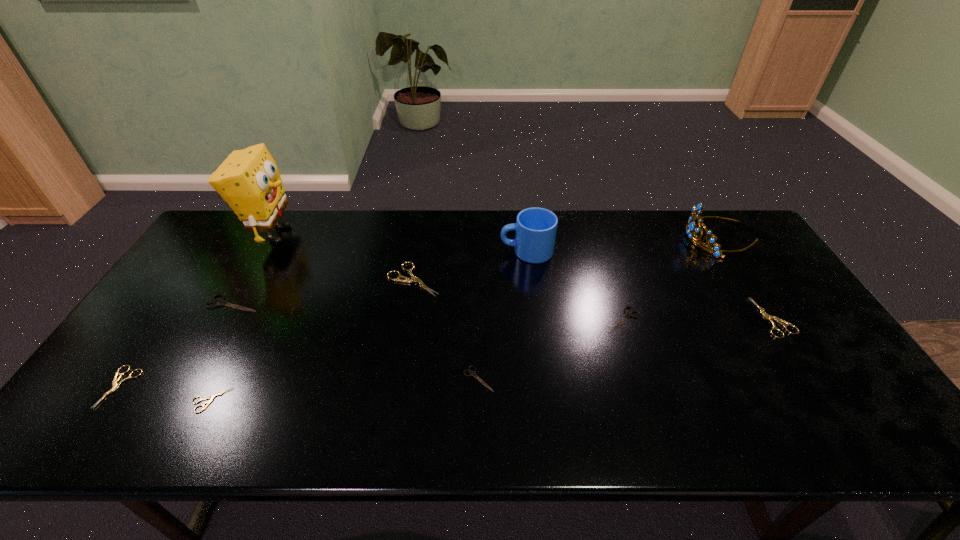
I want to click on free region at the far edge of the desktop, so click(282, 234).

The width and height of the screenshot is (960, 540). In the image, there is a desktop. Find the location of `vacant space at the near edge`. vacant space at the near edge is located at coordinates (613, 414).

Locate an element on the screen. The image size is (960, 540). blank space at the left edge is located at coordinates (101, 402).

I want to click on free region at the right edge of the desktop, so click(x=776, y=278).

In the image, there is a desktop. Identify the location of blank space at the far left corner. (242, 239).

What are the coordinates of `free space at the near left corner of the desktop` in the screenshot? It's located at (138, 429).

Where is `free space between the biggest black shears and the gold tiara`? Image resolution: width=960 pixels, height=540 pixels. free space between the biggest black shears and the gold tiara is located at coordinates (476, 271).

Find the location of a particular element. The height and width of the screenshot is (540, 960). free space between the mug and the smallest beige shears is located at coordinates (369, 326).

Image resolution: width=960 pixels, height=540 pixels. I want to click on vacant space that is in between the fourth shears from right to left and the rightmost beige shears, so click(593, 299).

Locate an element on the screen. This screenshot has width=960, height=540. free space between the second beige shears from left to right and the rightmost beige shears is located at coordinates [492, 359].